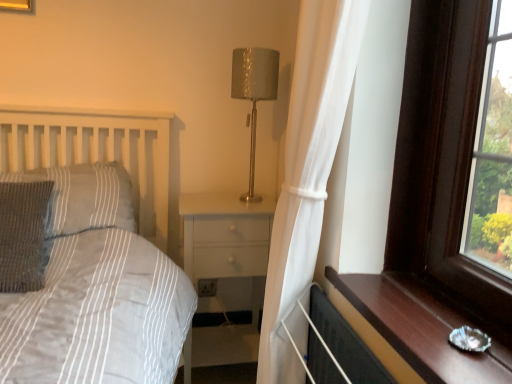
What do you see at coordinates (223, 234) in the screenshot?
I see `white glossy nightstand at center` at bounding box center [223, 234].

What is the approximate width of knitted fabric pillow at left, the 1th pillow when ordered from back to front?

knitted fabric pillow at left, the 1th pillow when ordered from back to front, is 15.89 inches in width.

What is the approximate height of knitted gray pillow at left, the 2th pillow positioned from the back?

knitted gray pillow at left, the 2th pillow positioned from the back, is 13.34 inches tall.

Measure the distance between knitted gray pillow at left, the 2th pillow positioned from the back, and camera.

4.11 feet.

This screenshot has height=384, width=512. I want to click on black rubber radiator at lower right, so click(x=335, y=347).

Locate an element on the screen. This screenshot has height=384, width=512. white glossy nightstand at center is located at coordinates (223, 234).

Consider the image. Is white sheer curtain at center facing towards brown wooden window sill at right?

No, white sheer curtain at center is not aimed at brown wooden window sill at right.

Is point (290, 123) positioned behind point (500, 343)?

That is True.

Is white sheer curtain at center not within brown wooden window sill at right?

white sheer curtain at center lies outside brown wooden window sill at right's area.

From the image's perspective, who appears lower, white sheer curtain at center or brown wooden window sill at right?

brown wooden window sill at right.

Is knitted gray pillow at left, the 2th pillow positioned from the back, in front of or behind metallic gold table lamp at center in the image?

knitted gray pillow at left, the 2th pillow positioned from the back, is in front of metallic gold table lamp at center.

Is knitted gray pillow at left, acting as the 1th pillow starting from the front, facing towards metallic gold table lamp at center?

No, knitted gray pillow at left, acting as the 1th pillow starting from the front, is not aimed at metallic gold table lamp at center.

How much distance is there between knitted gray pillow at left, acting as the 1th pillow starting from the front, and metallic gold table lamp at center?

They are 35.28 inches apart.

Locate an element on the screen. table lamp above the knitted gray pillow at left, acting as the 1th pillow starting from the front (from a real-world perspective) is located at coordinates pos(254,93).

This screenshot has height=384, width=512. In order to click on radiator above the white glossy nightstand at center (from a real-world perspective) in this screenshot , I will do `click(335, 347)`.

Considering the positions of point (326, 335) and point (241, 257), is point (326, 335) closer or farther from the camera than point (241, 257)?

Point (326, 335).

Considering the relative positions of black rubber radiator at lower right and white glossy nightstand at center in the image provided, is black rubber radiator at lower right to the left of white glossy nightstand at center from the viewer's perspective?

No.

Is white sheer curtain at center positioned behind knitted gray pillow at left, acting as the 1th pillow starting from the front?

No, it is in front of knitted gray pillow at left, acting as the 1th pillow starting from the front.

Does white sheer curtain at center have a lesser width compared to knitted gray pillow at left, the 2th pillow positioned from the back?

Indeed, white sheer curtain at center has a lesser width compared to knitted gray pillow at left, the 2th pillow positioned from the back.

From a real-world perspective, is white sheer curtain at center physically above knitted gray pillow at left, acting as the 1th pillow starting from the front?

Correct, in the physical world, white sheer curtain at center is higher than knitted gray pillow at left, acting as the 1th pillow starting from the front.

Would you say white sheer curtain at center is a long distance from knitted gray pillow at left, the 2th pillow positioned from the back?

No, white sheer curtain at center is in close proximity to knitted gray pillow at left, the 2th pillow positioned from the back.

How much distance is there between brown wooden window sill at right and white sheer curtain at center?

brown wooden window sill at right is 13.96 inches away from white sheer curtain at center.

Considering the relative positions of brown wooden window sill at right and white sheer curtain at center in the image provided, is brown wooden window sill at right behind white sheer curtain at center?

No, brown wooden window sill at right is in front of white sheer curtain at center.

Is brown wooden window sill at right far from white sheer curtain at center?

No, brown wooden window sill at right is not far away from white sheer curtain at center.

Is brown wooden window sill at right situated inside white sheer curtain at center or outside?

brown wooden window sill at right is outside white sheer curtain at center.

Is brown wooden window sill at right with knitted fabric pillow at left, positioned as the second pillow in front-to-back order?

No, brown wooden window sill at right is not next to knitted fabric pillow at left, positioned as the second pillow in front-to-back order.

From the image's perspective, is brown wooden window sill at right located beneath knitted fabric pillow at left, the 1th pillow when ordered from back to front?

Yes, from the image's perspective, brown wooden window sill at right is beneath knitted fabric pillow at left, the 1th pillow when ordered from back to front.

Considering their positions, is brown wooden window sill at right located in front of or behind knitted fabric pillow at left, the 1th pillow when ordered from back to front?

brown wooden window sill at right is in front of knitted fabric pillow at left, the 1th pillow when ordered from back to front.

Is white sheer curtain at center far away from black rubber radiator at lower right?

No, white sheer curtain at center is in close proximity to black rubber radiator at lower right.

In the image, is white sheer curtain at center positioned in front of or behind black rubber radiator at lower right?

white sheer curtain at center is in front of black rubber radiator at lower right.

In terms of size, does white sheer curtain at center appear bigger or smaller than black rubber radiator at lower right?

In the image, white sheer curtain at center appears to be larger than black rubber radiator at lower right.

The height and width of the screenshot is (384, 512). I want to click on curtain on the left of brown wooden window sill at right, so click(x=307, y=176).

Find the location of `table lamp on the right of knitted gray pillow at left, acting as the 1th pillow starting from the front`. table lamp on the right of knitted gray pillow at left, acting as the 1th pillow starting from the front is located at coordinates (254, 93).

When comparing their distances from white glossy nightstand at center, does knitted fabric pillow at left, positioned as the second pillow in front-to-back order, or metallic gold table lamp at center seem closer?

knitted fabric pillow at left, positioned as the second pillow in front-to-back order, is positioned closer to the anchor white glossy nightstand at center.

Which object lies nearer to the anchor point black rubber radiator at lower right, brown wooden window sill at right or white glossy nightstand at center?

brown wooden window sill at right is positioned closer to the anchor black rubber radiator at lower right.

Based on their spatial positions, is black rubber radiator at lower right or knitted fabric pillow at left, positioned as the second pillow in front-to-back order, further from knitted gray pillow at left, the 2th pillow positioned from the back?

Among the two, black rubber radiator at lower right is located further to knitted gray pillow at left, the 2th pillow positioned from the back.

Based on their spatial positions, is white sheer curtain at center or white glossy nightstand at center closer to knitted fabric pillow at left, the 1th pillow when ordered from back to front?

The object closer to knitted fabric pillow at left, the 1th pillow when ordered from back to front, is white glossy nightstand at center.

Considering their positions, is knitted gray pillow at left, acting as the 1th pillow starting from the front, positioned further to brown wooden window sill at right than black rubber radiator at lower right?

Based on the image, knitted gray pillow at left, acting as the 1th pillow starting from the front, appears to be further to brown wooden window sill at right.

Considering their positions, is white sheer curtain at center positioned closer to brown wooden window sill at right than white glossy nightstand at center?

white sheer curtain at center is positioned closer to the anchor brown wooden window sill at right.

Estimate the real-world distances between objects in this image. Which object is further from white sheer curtain at center, black rubber radiator at lower right or white glossy nightstand at center?

white glossy nightstand at center is further to white sheer curtain at center.

Based on their spatial positions, is white glossy nightstand at center or knitted gray pillow at left, acting as the 1th pillow starting from the front, further from white sheer curtain at center?

knitted gray pillow at left, acting as the 1th pillow starting from the front, is further to white sheer curtain at center.

Locate an element on the screen. The image size is (512, 384). nightstand between knitted fabric pillow at left, the 1th pillow when ordered from back to front, and white sheer curtain at center is located at coordinates (223, 234).

At what (x,y) coordinates should I click in order to perform the action: click on radiator between knitted gray pillow at left, the 2th pillow positioned from the back, and brown wooden window sill at right, in the horizontal direction. Please return your answer as a coordinate pair (x, y). Looking at the image, I should click on (335, 347).

You are a GUI agent. You are given a task and a screenshot of the screen. Output one action in this format:
    pyautogui.click(x=<x>, y=<y>)
    Task: Click on the radiator between brown wooden window sill at right and white glossy nightstand at center from front to back
    The height and width of the screenshot is (384, 512).
    Given the screenshot: What is the action you would take?
    pyautogui.click(x=335, y=347)

Find the location of a particular element. The image size is (512, 384). pillow between knitted gray pillow at left, the 2th pillow positioned from the back, and metallic gold table lamp at center, in the horizontal direction is located at coordinates (84, 197).